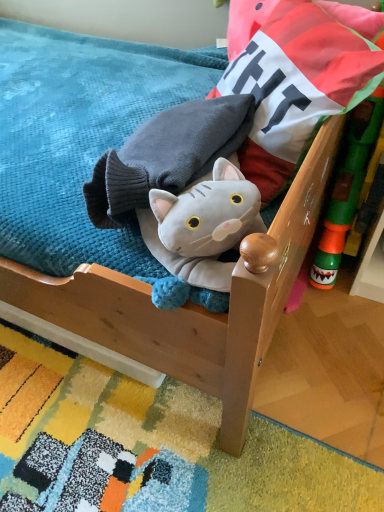
Question: In terms of width, does soft blue fabric at upper left look wider or thinner when compared to green plastic toy at right?

Choices:
 (A) thin
 (B) wide

Answer: (B)

Question: Is soft blue fabric at upper left situated inside green plastic toy at right or outside?

Choices:
 (A) inside
 (B) outside

Answer: (B)

Question: Which of these objects is positioned farthest from the green plastic toy at right?

Choices:
 (A) soft blue fabric at upper left
 (B) velvet cushion at upper right

Answer: (A)

Question: Based on their relative distances, which object is nearer to the velvet cushion at upper right?

Choices:
 (A) soft blue fabric at upper left
 (B) green plastic toy at right

Answer: (B)